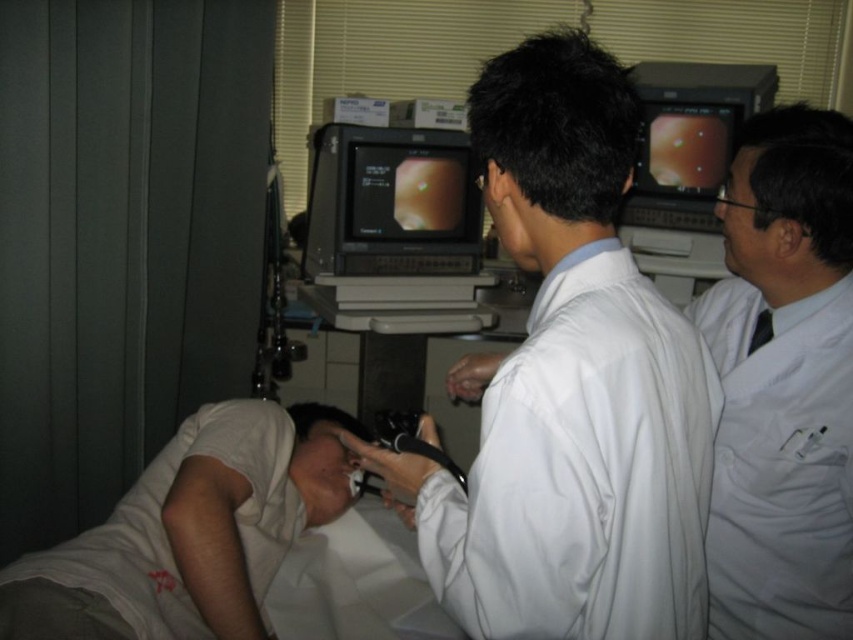
Question: Among these objects, which one is farthest from the camera?

Choices:
 (A) white cotton shirt at lower left
 (B) white lab coat at upper right

Answer: (A)

Question: Is white lab coat at upper right smaller than white cotton shirt at lower left?

Choices:
 (A) no
 (B) yes

Answer: (B)

Question: Which point appears farthest from the camera in this image?

Choices:
 (A) coord(364,129)
 (B) coord(207,461)
 (C) coord(654,312)
 (D) coord(817,125)

Answer: (A)

Question: Among these objects, which one is nearest to the camera?

Choices:
 (A) white smooth lab coat at center
 (B) white lab coat at upper right
 (C) black glossy monitor at center
 (D) white cotton shirt at lower left

Answer: (A)

Question: Can you confirm if white smooth lab coat at center is smaller than white cotton shirt at lower left?

Choices:
 (A) yes
 (B) no

Answer: (B)

Question: Can you confirm if white smooth lab coat at center is wider than white lab coat at upper right?

Choices:
 (A) no
 (B) yes

Answer: (B)